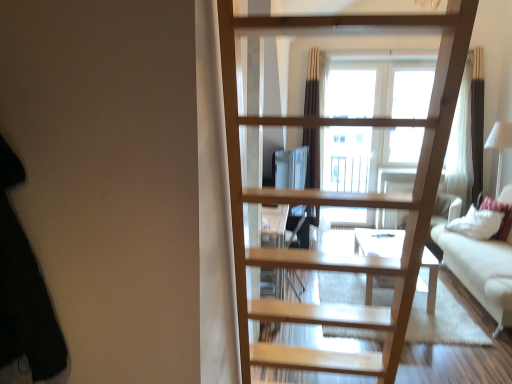
Question: Is white fabric couch at right wider than white soft pillow at right?

Choices:
 (A) yes
 (B) no

Answer: (A)

Question: Is white fabric couch at right next to white soft pillow at right and touching it?

Choices:
 (A) yes
 (B) no

Answer: (B)

Question: From a real-world perspective, is white fabric couch at right on white soft pillow at right?

Choices:
 (A) yes
 (B) no

Answer: (B)

Question: Is white fabric couch at right at the left side of white soft pillow at right?

Choices:
 (A) yes
 (B) no

Answer: (A)

Question: Is white fabric couch at right shorter than white soft pillow at right?

Choices:
 (A) no
 (B) yes

Answer: (A)

Question: Is there a large distance between white fabric couch at right and white soft pillow at right?

Choices:
 (A) no
 (B) yes

Answer: (A)

Question: Is white fabric couch at right smaller than black fabric at left?

Choices:
 (A) no
 (B) yes

Answer: (A)

Question: Can you confirm if white fabric couch at right is taller than black fabric at left?

Choices:
 (A) no
 (B) yes

Answer: (A)

Question: From the image's perspective, is white fabric couch at right located above black fabric at left?

Choices:
 (A) no
 (B) yes

Answer: (A)

Question: Considering the relative sizes of white fabric couch at right and black fabric at left in the image provided, is white fabric couch at right thinner than black fabric at left?

Choices:
 (A) yes
 (B) no

Answer: (B)

Question: From a real-world perspective, is white fabric couch at right physically below black fabric at left?

Choices:
 (A) yes
 (B) no

Answer: (A)

Question: Is white fabric couch at right at the right side of black fabric at left?

Choices:
 (A) yes
 (B) no

Answer: (A)

Question: Is black fabric at left behind natural wood ladder at center?

Choices:
 (A) yes
 (B) no

Answer: (B)